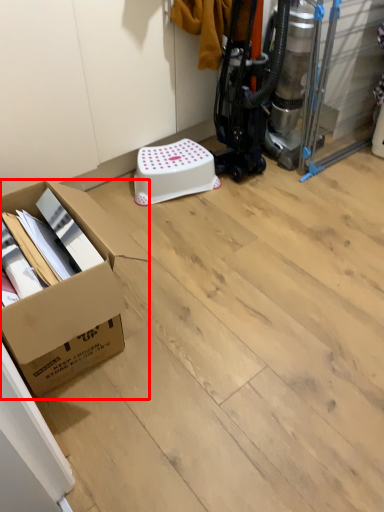
Question: From the image's perspective, what is the correct spatial relationship of box (annotated by the red box) in relation to stool?

Choices:
 (A) above
 (B) below

Answer: (B)